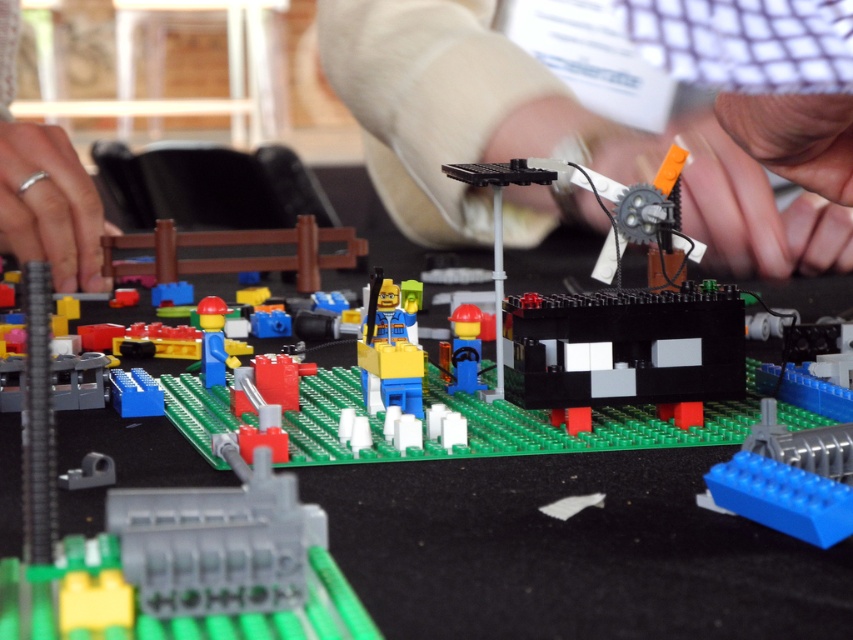
Is green plastic table at center shorter than silver metallic ring at lower left?

Indeed, green plastic table at center has a lesser height compared to silver metallic ring at lower left.

Can you confirm if green plastic table at center is taller than silver metallic ring at lower left?

No.

The image size is (853, 640). I want to click on green plastic table at center, so point(570,550).

Is smooth plastic hand at center above gray plastic connector at center?

Correct, smooth plastic hand at center is located above gray plastic connector at center.

Looking at this image, does smooth plastic hand at center have a larger size compared to gray plastic connector at center?

Yes, smooth plastic hand at center is bigger than gray plastic connector at center.

Between point (329, 58) and point (86, 545), which one is positioned in front?

Point (86, 545) is more forward.

Identify the location of smooth plastic hand at center. The width and height of the screenshot is (853, 640). (538, 136).

Between point (1, 490) and point (373, 330), which one is positioned in front?

Point (1, 490) is more forward.

Is green plastic table at center above brick-like yellow figure at center?

Yes, green plastic table at center is above brick-like yellow figure at center.

What are the coordinates of `green plastic table at center` in the screenshot? It's located at (570, 550).